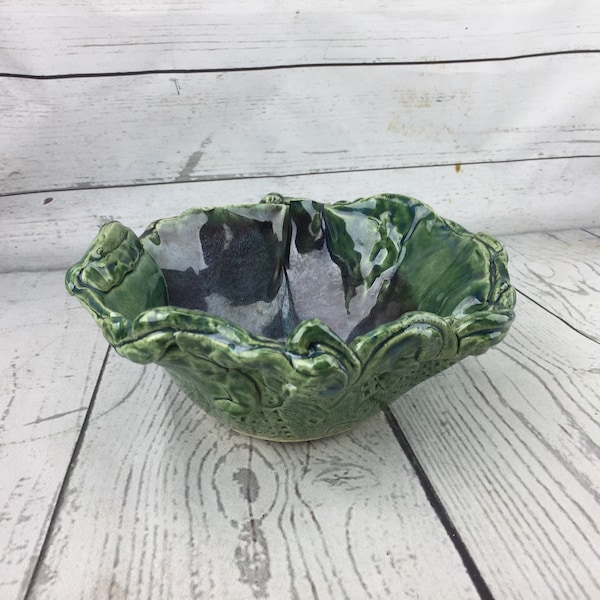
The width and height of the screenshot is (600, 600). In order to click on wall in this screenshot , I will do `click(273, 104)`.